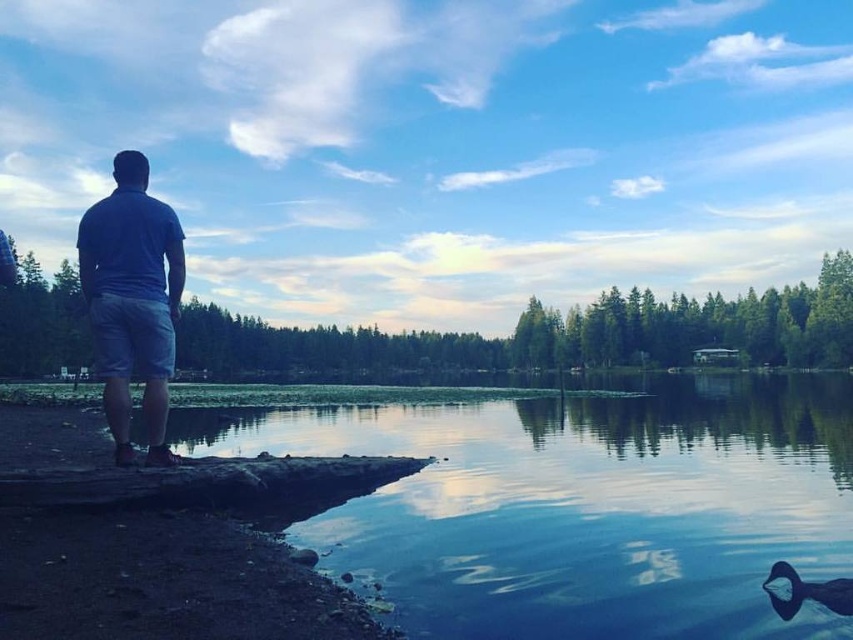
Which is in front, point (86, 252) or point (776, 600)?

Point (776, 600) is in front.

Is point (166, 275) closer to viewer compared to point (805, 582)?

No, (166, 275) is behind (805, 582).

Is point (136, 250) positioned after point (786, 589)?

Yes, it is.

Image resolution: width=853 pixels, height=640 pixels. I want to click on blue cotton shirt at left, so click(132, 300).